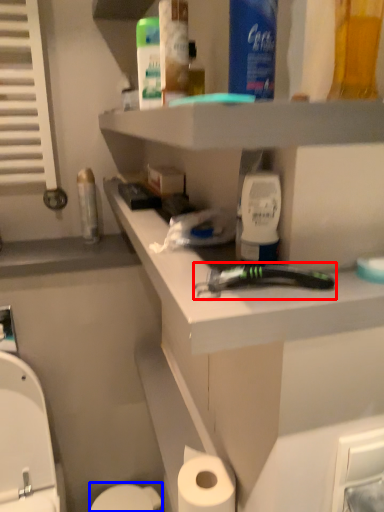
Question: Which of the following is the closest to the observer, tool (highlighted by a red box) or toilet bowl (highlighted by a blue box)?

Choices:
 (A) tool
 (B) toilet bowl

Answer: (A)